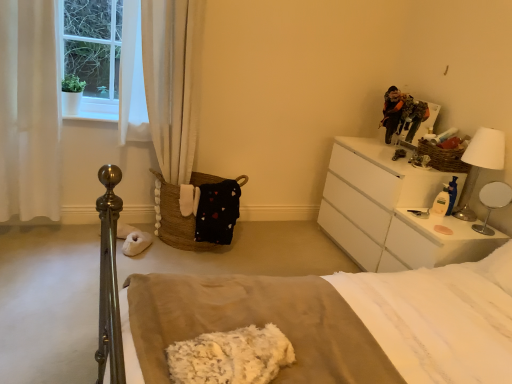
This screenshot has height=384, width=512. I want to click on vacant space situated above white metallic table lamp at upper right, the 1th table lamp when ordered from top to bottom (from a real-world perspective), so 497,132.